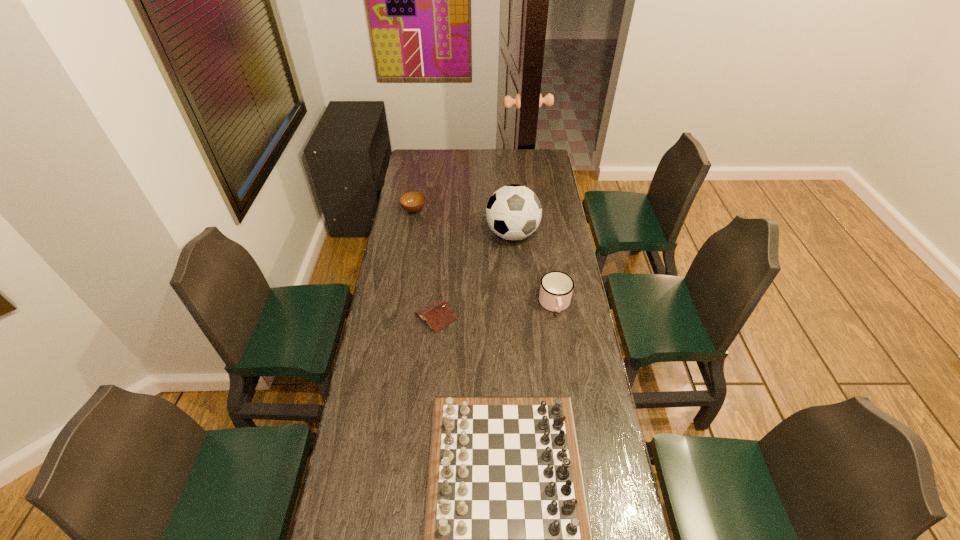
The width and height of the screenshot is (960, 540). Find the location of `the tallest object`. the tallest object is located at coordinates (513, 212).

Image resolution: width=960 pixels, height=540 pixels. Identify the location of mug. (556, 288).

Where is `the leftmost object`? The height and width of the screenshot is (540, 960). the leftmost object is located at coordinates (413, 202).

Image resolution: width=960 pixels, height=540 pixels. What are the coordinates of `bowl` in the screenshot? It's located at (413, 202).

Find the location of a particular element. book is located at coordinates (438, 314).

The height and width of the screenshot is (540, 960). In order to click on vacant point located 0.360m on the main logo of the tallest object in this screenshot , I will do `click(518, 314)`.

The image size is (960, 540). I want to click on vacant space located 0.400m on the side of the mug with the handle, so click(x=572, y=417).

The image size is (960, 540). In order to click on free spot located on the right of the bowl in this screenshot , I will do `click(491, 211)`.

Locate an element on the screen. The height and width of the screenshot is (540, 960). free space located on the front of the book is located at coordinates (430, 380).

Image resolution: width=960 pixels, height=540 pixels. I want to click on bowl that is at the left edge, so (x=413, y=202).